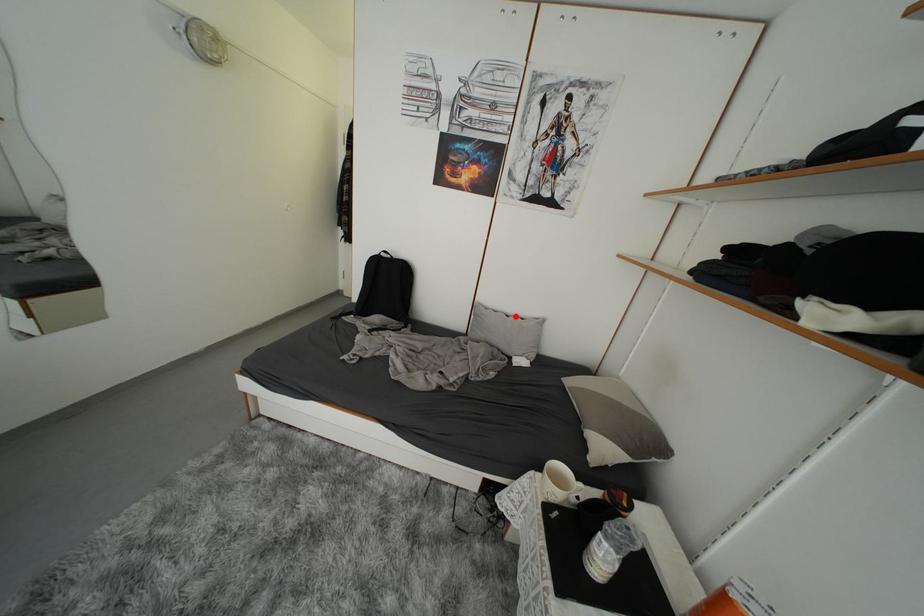
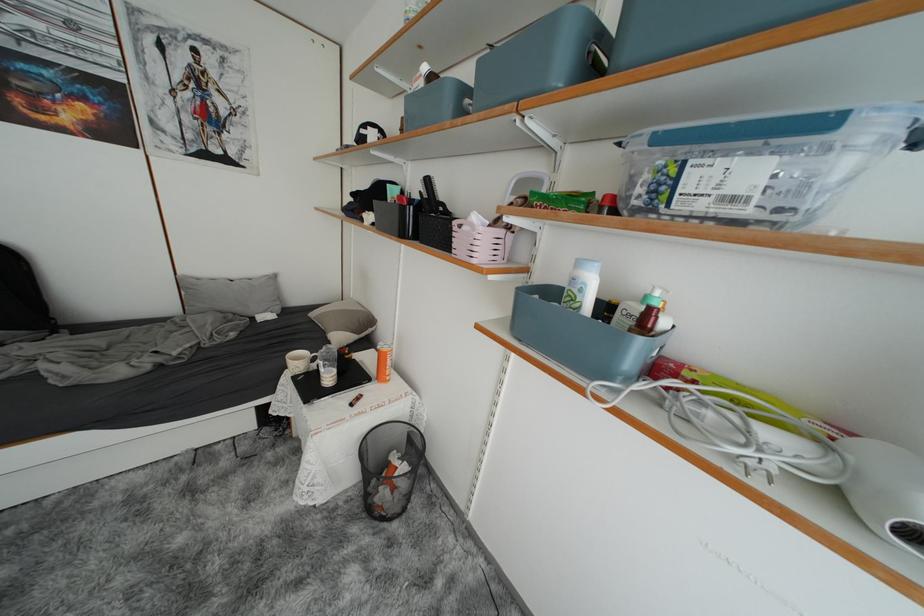
Find the pixel in the second image that matches the highlighted location in the first image.

(238, 281)